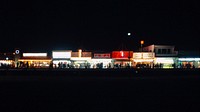
This screenshot has height=112, width=200. In order to click on windows in this screenshot , I will do `click(158, 52)`, `click(162, 52)`, `click(168, 51)`.